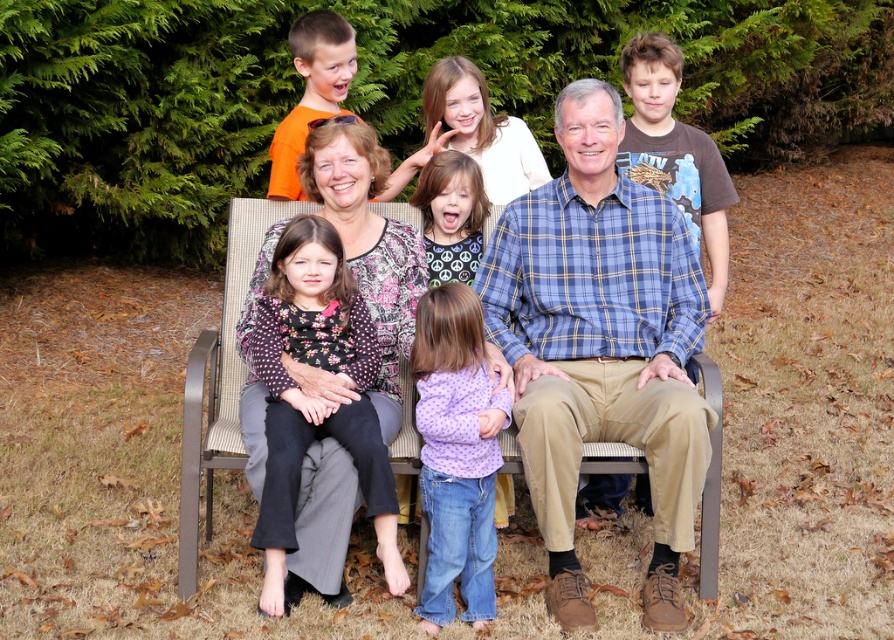
Image resolution: width=894 pixels, height=640 pixels. What do you see at coordinates (456, 452) in the screenshot? I see `purple polka dot shirt at center` at bounding box center [456, 452].

Locate an element on the screen. Image resolution: width=894 pixels, height=640 pixels. purple polka dot shirt at center is located at coordinates (456, 452).

Can you confirm if brown cotton t-shirt at right is wider than green fabric shirt at center?

Yes.

Is brown cotton t-shirt at right smaller than green fabric shirt at center?

No.

Who is more forward, (673, 168) or (478, 193)?

Positioned in front is point (478, 193).

The width and height of the screenshot is (894, 640). Find the location of `brown cotton t-shirt at right`. brown cotton t-shirt at right is located at coordinates (675, 150).

Is floral-patterned shirt at left to the right of purple polka dot shirt at center from the viewer's perspective?

No, floral-patterned shirt at left is not to the right of purple polka dot shirt at center.

Can you confirm if floral-patterned shirt at left is positioned to the left of purple polka dot shirt at center?

Indeed, floral-patterned shirt at left is positioned on the left side of purple polka dot shirt at center.

Is point (327, 300) behind point (449, 481)?

That is True.

Where is `floral-patterned shirt at left`? floral-patterned shirt at left is located at coordinates (322, 372).